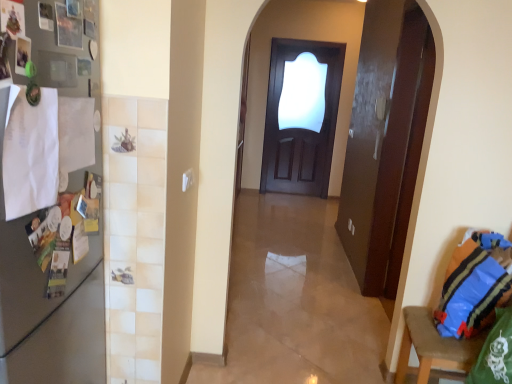
Question: From a real-world perspective, is satin silver fridge at left under blue striped fabric pillow at right?

Choices:
 (A) yes
 (B) no

Answer: (B)

Question: Considering the relative sizes of satin silver fridge at left and blue striped fabric pillow at right in the image provided, is satin silver fridge at left shorter than blue striped fabric pillow at right?

Choices:
 (A) yes
 (B) no

Answer: (B)

Question: Can you confirm if satin silver fridge at left is wider than blue striped fabric pillow at right?

Choices:
 (A) no
 (B) yes

Answer: (B)

Question: Does satin silver fridge at left have a greater height compared to blue striped fabric pillow at right?

Choices:
 (A) yes
 (B) no

Answer: (A)

Question: From the image's perspective, is satin silver fridge at left beneath blue striped fabric pillow at right?

Choices:
 (A) no
 (B) yes

Answer: (A)

Question: Is blue fabric bag at lower right situated inside blue striped fabric pillow at right or outside?

Choices:
 (A) inside
 (B) outside

Answer: (B)

Question: From a real-world perspective, is blue fabric bag at lower right above or below blue striped fabric pillow at right?

Choices:
 (A) above
 (B) below

Answer: (B)

Question: Is point click(x=501, y=259) positioned closer to the camera than point click(x=501, y=284)?

Choices:
 (A) closer
 (B) farther

Answer: (B)

Question: From the image's perspective, relative to blue striped fabric pillow at right, is blue fabric bag at lower right above or below?

Choices:
 (A) above
 (B) below

Answer: (B)

Question: Looking at their shapes, would you say blue fabric bag at lower right is wider or thinner than satin silver fridge at left?

Choices:
 (A) thin
 (B) wide

Answer: (B)

Question: Relative to satin silver fridge at left, is blue fabric bag at lower right in front or behind?

Choices:
 (A) front
 (B) behind

Answer: (B)

Question: From the image's perspective, relative to satin silver fridge at left, is blue fabric bag at lower right above or below?

Choices:
 (A) below
 (B) above

Answer: (A)

Question: Considering the positions of blue fabric bag at lower right and satin silver fridge at left in the image, is blue fabric bag at lower right taller or shorter than satin silver fridge at left?

Choices:
 (A) tall
 (B) short

Answer: (B)

Question: Is point (481, 296) positioned closer to the camera than point (436, 342)?

Choices:
 (A) farther
 (B) closer

Answer: (B)

Question: Would you say blue striped fabric pillow at right is inside or outside blue fabric bag at lower right?

Choices:
 (A) outside
 (B) inside

Answer: (B)